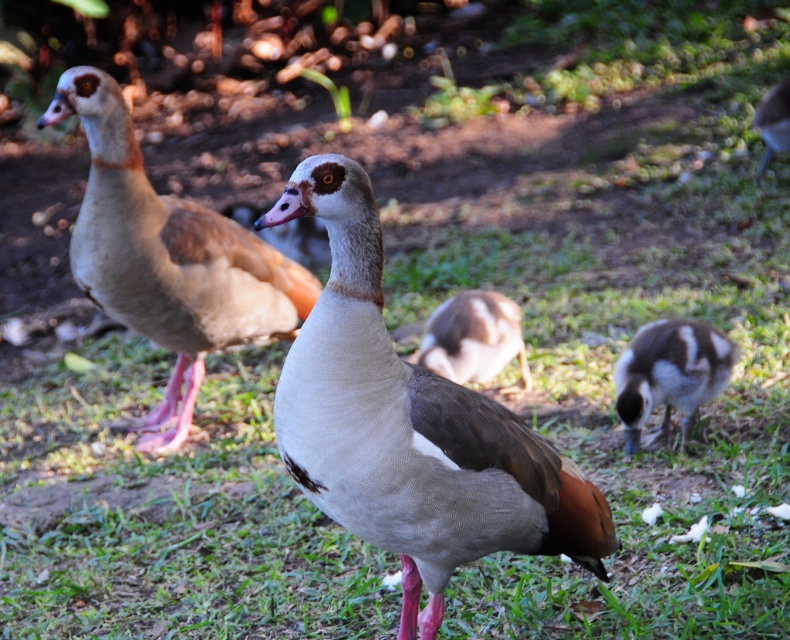
Can you confirm if brown feathered duck at left is shorter than brown downy duckling at lower right?

In fact, brown feathered duck at left may be taller than brown downy duckling at lower right.

Between point (81, 115) and point (698, 339), which one is positioned behind?

The point (81, 115) is behind.

Is point (194, 317) positioned before point (645, 365)?

No, (194, 317) is further to viewer.

What are the coordinates of `brown feathered duck at left` in the screenshot? It's located at (167, 259).

Is brown feathered duck at left further to the viewer compared to brown feathered duckling at center?

That is False.

Describe the element at coordinates (167, 259) in the screenshot. Image resolution: width=790 pixels, height=640 pixels. I see `brown feathered duck at left` at that location.

Find the location of a particular element. Image resolution: width=790 pixels, height=640 pixels. brown feathered duck at left is located at coordinates (167, 259).

How much distance is there between matte brown duck at center and brown downy duckling at lower right?

They are 1.44 meters apart.

Is matte brown duck at center thinner than brown downy duckling at lower right?

Incorrect, matte brown duck at center's width is not less than brown downy duckling at lower right's.

Which is behind, point (420, 618) or point (700, 326)?

Point (700, 326)

Identify the location of matte brown duck at center. (409, 426).